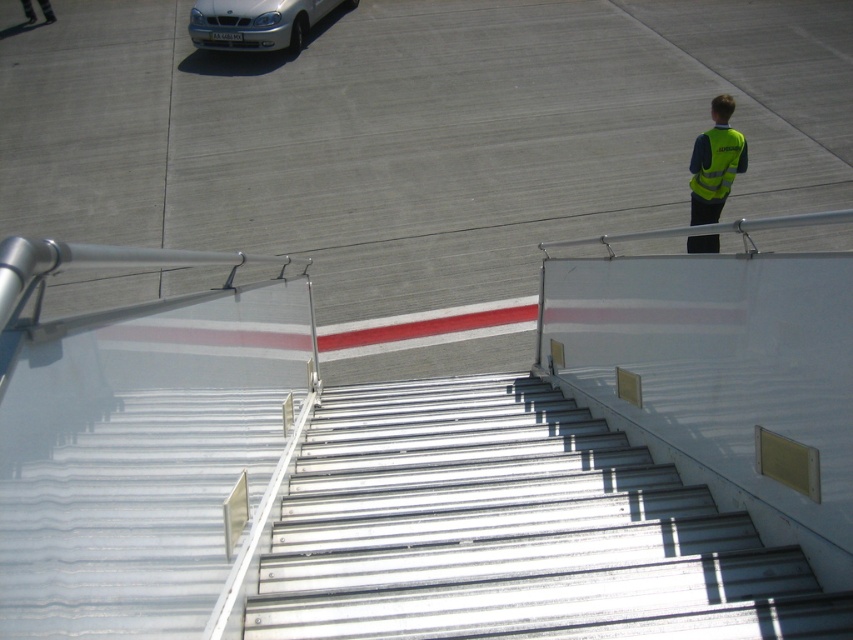
You are a passenger standing at the bottom of the staircase in the airport jet bridge. You need to locate the yellow reflective vest at upper right. According to the coordinates provided, where exactly should you look to find it?

The yellow reflective vest at upper right is located at point coordinates of (715,163).

You are a flight attendant carrying a heavy luggage cart that is 2 meters wide. You need to navigate down the metallic silver stairs at center while avoiding the silver metallic car at upper left. Can you safely pass through the staircase without hitting the car?

The metallic silver stairs at center has a lesser width compared to silver metallic car at upper left. Since the stairs are narrower than the car, the luggage cart might not fit through the staircase, making it unsafe to pass without hitting the car.